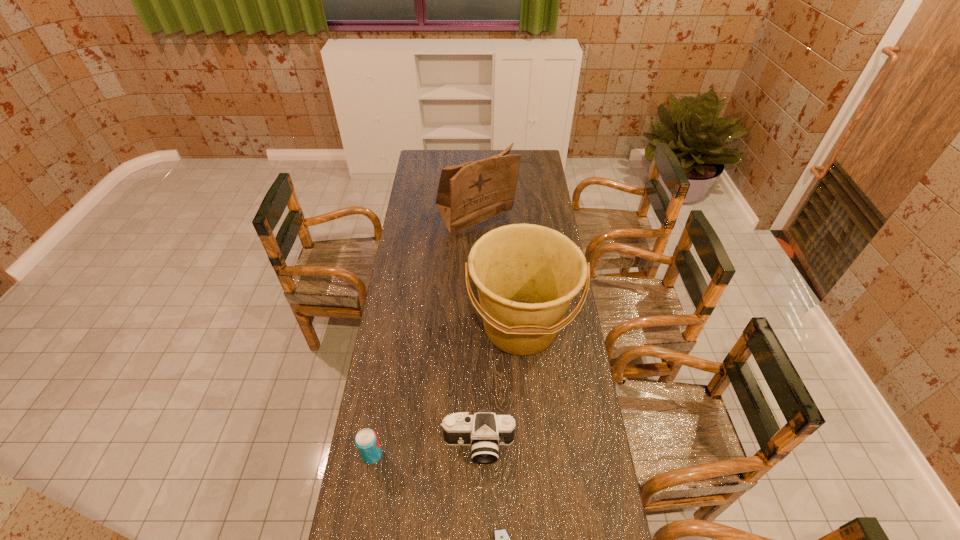
This screenshot has height=540, width=960. Identify the location of grocery bag. (468, 194).

Where is `the tallest object`? This screenshot has width=960, height=540. the tallest object is located at coordinates click(468, 194).

Locate an element on the screen. The height and width of the screenshot is (540, 960). the fourth shortest object is located at coordinates (526, 275).

Where is `the fourth nearest object`? This screenshot has width=960, height=540. the fourth nearest object is located at coordinates (526, 275).

Find the location of a particular element. camera is located at coordinates (484, 431).

At what (x,y) coordinates should I click in order to perform the action: click on the leftmost object. Please return your answer as a coordinate pair (x, y). Looking at the image, I should click on click(x=366, y=440).

Where is `vacant area situated on the front of the farthest object`? The height and width of the screenshot is (540, 960). vacant area situated on the front of the farthest object is located at coordinates (474, 310).

Where is `free spot located on the side of the bucket with the handle`? This screenshot has width=960, height=540. free spot located on the side of the bucket with the handle is located at coordinates (532, 471).

Where is `vacant point located 0.270m on the right of the camera`? The width and height of the screenshot is (960, 540). vacant point located 0.270m on the right of the camera is located at coordinates (596, 446).

The height and width of the screenshot is (540, 960). Identify the location of vacant position located on the right of the leftmost object. (478, 455).